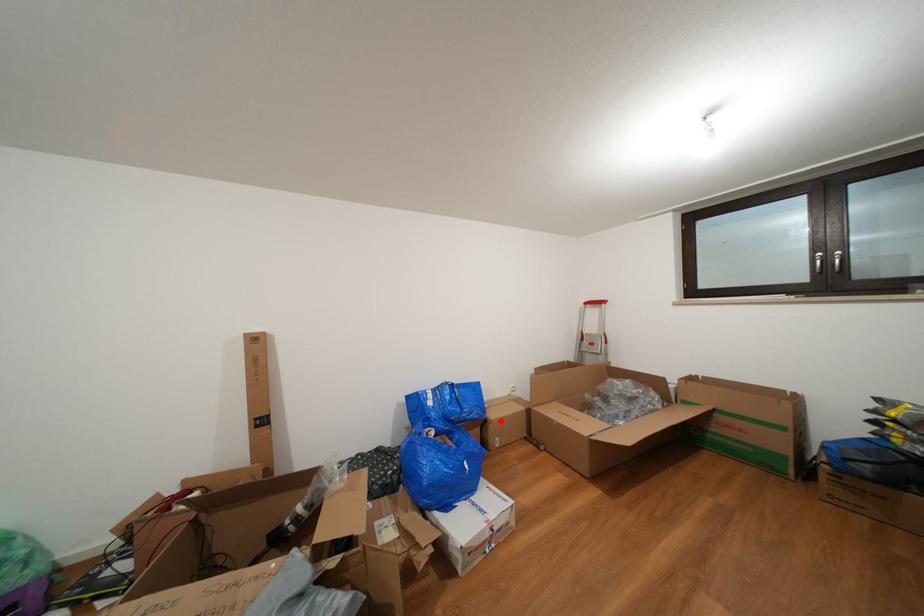
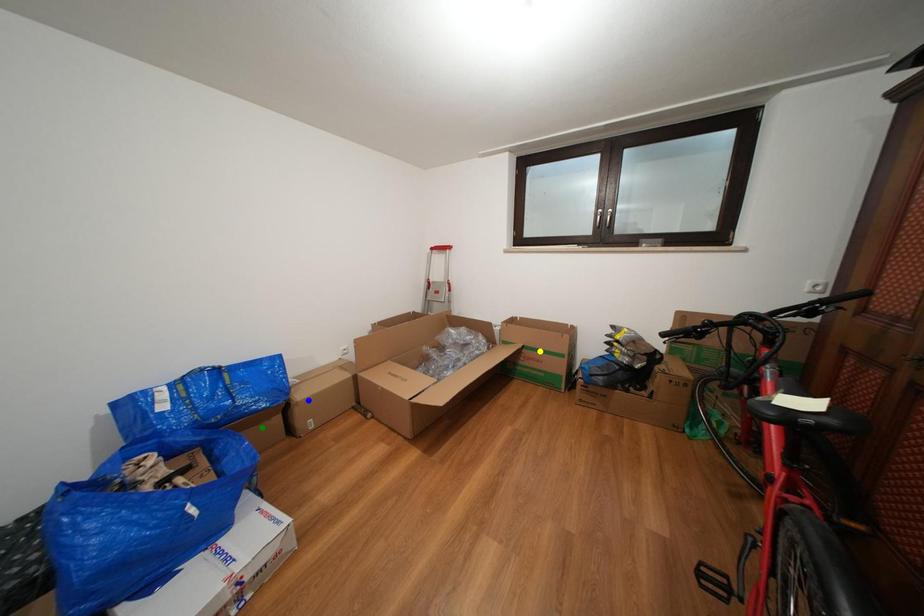
Question: I am providing you with two images of the same scene from different viewpoints. A red point is marked on the first image. You are given multiple points on the second image. In image 2, which mark is for the same physical point as the one in image 1?

Choices:
 (A) blue point
 (B) yellow point
 (C) green point

Answer: (A)